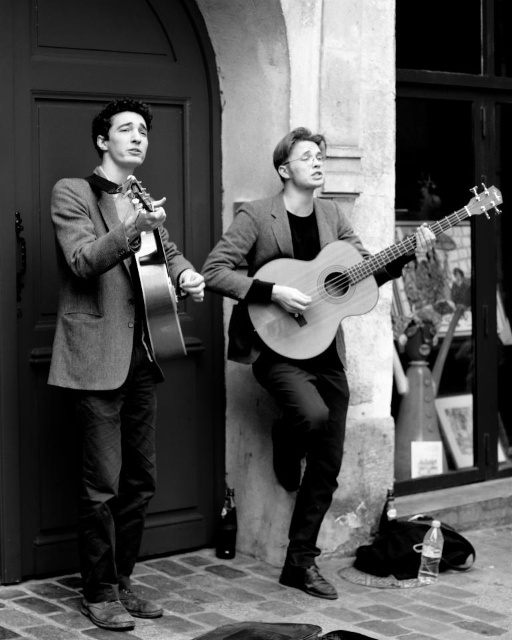
Question: Can you confirm if matte gray blazer at left is thinner than matte wood guitar at center?

Choices:
 (A) yes
 (B) no

Answer: (A)

Question: Which is nearer to the matte wood guitar at center?

Choices:
 (A) matte acoustic guitar at center
 (B) matte gray blazer at left
 (C) wooden acoustic guitar at center

Answer: (C)

Question: Can you confirm if matte wood guitar at center is thinner than wooden acoustic guitar at center?

Choices:
 (A) no
 (B) yes

Answer: (B)

Question: Which object appears closest to the camera in this image?

Choices:
 (A) matte acoustic guitar at center
 (B) matte gray blazer at left

Answer: (B)

Question: Can you confirm if matte gray blazer at left is positioned to the right of matte acoustic guitar at center?

Choices:
 (A) yes
 (B) no

Answer: (B)

Question: Which of the following is the closest to the observer?

Choices:
 (A) (116, 396)
 (B) (287, 348)
 (C) (245, 305)
 (D) (159, 312)

Answer: (D)